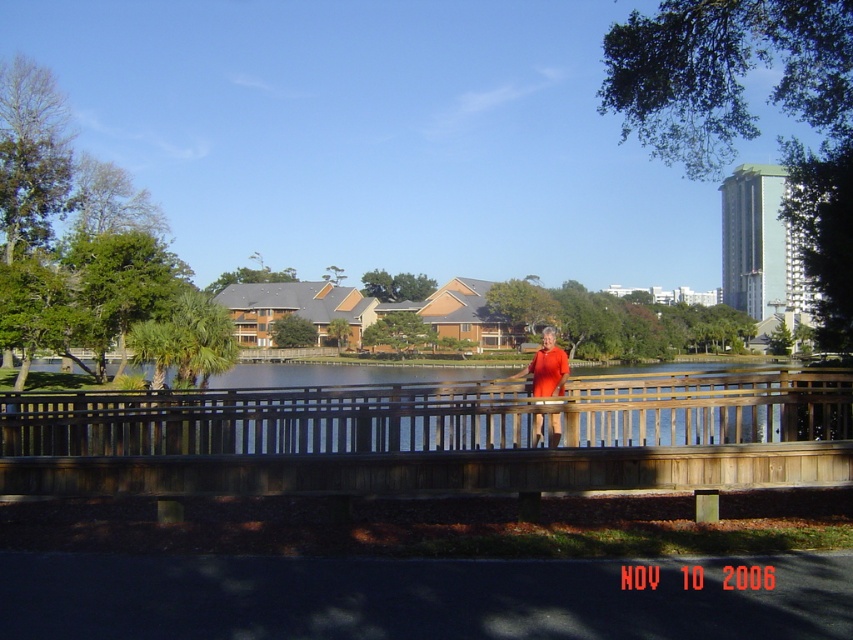
You are a photographer standing on the wooden railing in the foreground. You want to capture a photo of the brown wooden bridge at center and the orange matte dress at center. Which object will appear closer to the camera in the photo?

The orange matte dress at center will appear closer to the camera in the photo because it has a greater height than the brown wooden bridge at center.

You are standing at the edge of the wooden railing in the foreground of the scene. You want to cross to the far side of the water where the trees are. The brown wooden bridge at center is your only path. Based on its position, can you estimate whether the bridge is directly in front of you or to one side?

The brown wooden bridge at center is located at coordinates point (432,436), which places it centrally in the scene. Since you are at the edge of the wooden railing in the foreground, the bridge is directly in front of you, providing a straight path toward the far side with the trees.

You are standing on the wooden railing in the foreground and want to walk to the orange matte dress at center. Which direction should you go to avoid the brown wooden bridge at center?

The brown wooden bridge at center is in front of the orange matte dress at center, so you should walk around the brown wooden bridge at center to reach the orange matte dress at center.